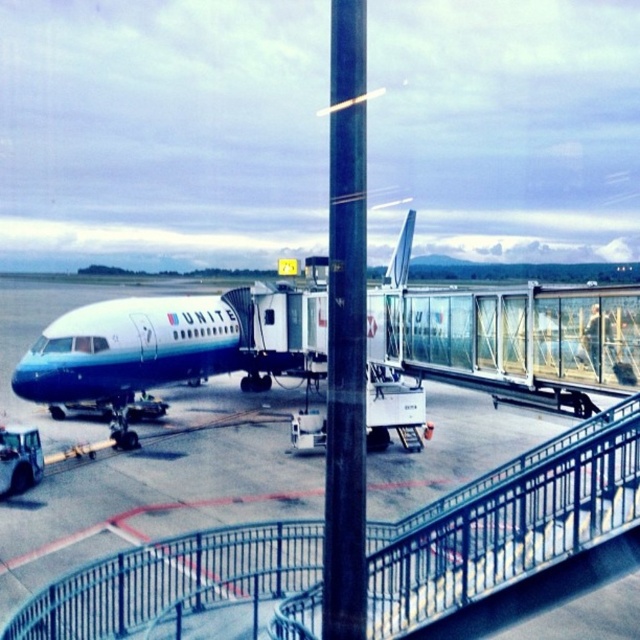
Between point (280, 442) and point (352, 552), which one is positioned in front?

Point (352, 552)

Can you confirm if blue glossy tarmac at center is positioned to the left of metallic pole at center?

Yes, blue glossy tarmac at center is to the left of metallic pole at center.

This screenshot has width=640, height=640. I want to click on blue glossy tarmac at center, so click(161, 486).

Is blue polished airplane at center positioned before metallic pole at center?

No, it is not.

This screenshot has height=640, width=640. What do you see at coordinates (172, 346) in the screenshot?
I see `blue polished airplane at center` at bounding box center [172, 346].

Between point (369, 403) and point (336, 387), which one is positioned behind?

The point (369, 403) is more distant.

Locate an element on the screen. The width and height of the screenshot is (640, 640). blue polished airplane at center is located at coordinates (172, 346).

Can you confirm if blue glossy tarmac at center is taller than blue polished airplane at center?

In fact, blue glossy tarmac at center may be shorter than blue polished airplane at center.

Does point (196, 413) come closer to viewer compared to point (120, 388)?

No, it is not.

Which is behind, point (525, 442) or point (160, 323)?

The point (160, 323) is behind.

Locate an element on the screen. blue glossy tarmac at center is located at coordinates (161, 486).